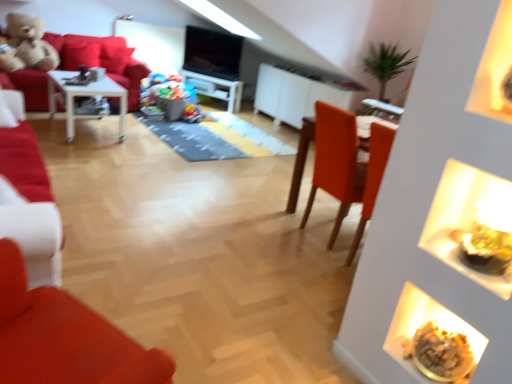
Question: Is matte orange table at center, the first table positioned from the bottom, at the left side of matte white chair at left?

Choices:
 (A) no
 (B) yes

Answer: (A)

Question: Is matte white chair at left at the back of matte orange table at center, the first table positioned from the bottom?

Choices:
 (A) yes
 (B) no

Answer: (A)

Question: From a real-world perspective, does matte orange table at center, acting as the 1th table starting from the front, sit lower than matte white chair at left?

Choices:
 (A) yes
 (B) no

Answer: (A)

Question: Does matte orange table at center, the 2th table in the left-to-right sequence, turn towards matte white chair at left?

Choices:
 (A) no
 (B) yes

Answer: (A)

Question: Is matte orange table at center, the first table in the right-to-left sequence, completely or partially outside of matte white chair at left?

Choices:
 (A) yes
 (B) no

Answer: (A)

Question: Does point 193,117 appear closer or farther from the camera than point 445,329?

Choices:
 (A) closer
 (B) farther

Answer: (B)

Question: Considering the positions of smooth plastic toy at center, marked as the 2th food in a bottom-to-top arrangement, and golden crumbly snack at lower right, positioned as the second food in left-to-right order, in the image, is smooth plastic toy at center, marked as the 2th food in a bottom-to-top arrangement, taller or shorter than golden crumbly snack at lower right, positioned as the second food in left-to-right order,?

Choices:
 (A) short
 (B) tall

Answer: (B)

Question: From the image's perspective, relative to golden crumbly snack at lower right, which is the 1th food from right to left, is smooth plastic toy at center, marked as the 2th food in a bottom-to-top arrangement, above or below?

Choices:
 (A) above
 (B) below

Answer: (A)

Question: Considering the positions of smooth plastic toy at center, arranged as the 1th food when viewed from the back, and golden crumbly snack at lower right, the 2th food positioned from the top, in the image, is smooth plastic toy at center, arranged as the 1th food when viewed from the back, bigger or smaller than golden crumbly snack at lower right, the 2th food positioned from the top,?

Choices:
 (A) small
 (B) big

Answer: (B)

Question: Is point (139, 81) positioned closer to the camera than point (39, 279)?

Choices:
 (A) closer
 (B) farther

Answer: (B)

Question: From the image's perspective, is velvet plush teddy bear at upper left located above or below matte white chair at left?

Choices:
 (A) above
 (B) below

Answer: (A)

Question: Considering the positions of velvet plush teddy bear at upper left and matte white chair at left in the image, is velvet plush teddy bear at upper left taller or shorter than matte white chair at left?

Choices:
 (A) short
 (B) tall

Answer: (B)

Question: Is velvet plush teddy bear at upper left bigger or smaller than matte white chair at left?

Choices:
 (A) big
 (B) small

Answer: (A)

Question: Does point (64, 46) appear closer or farther from the camera than point (197, 87)?

Choices:
 (A) closer
 (B) farther

Answer: (A)

Question: From a real-world perspective, is velvet plush teddy bear at upper left above or below white glossy entertainment center at center?

Choices:
 (A) above
 (B) below

Answer: (A)